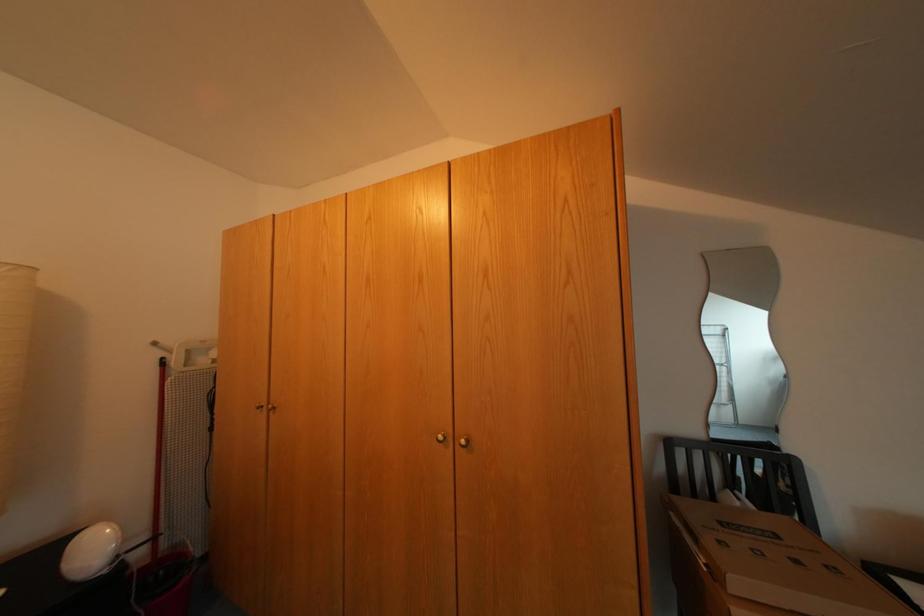
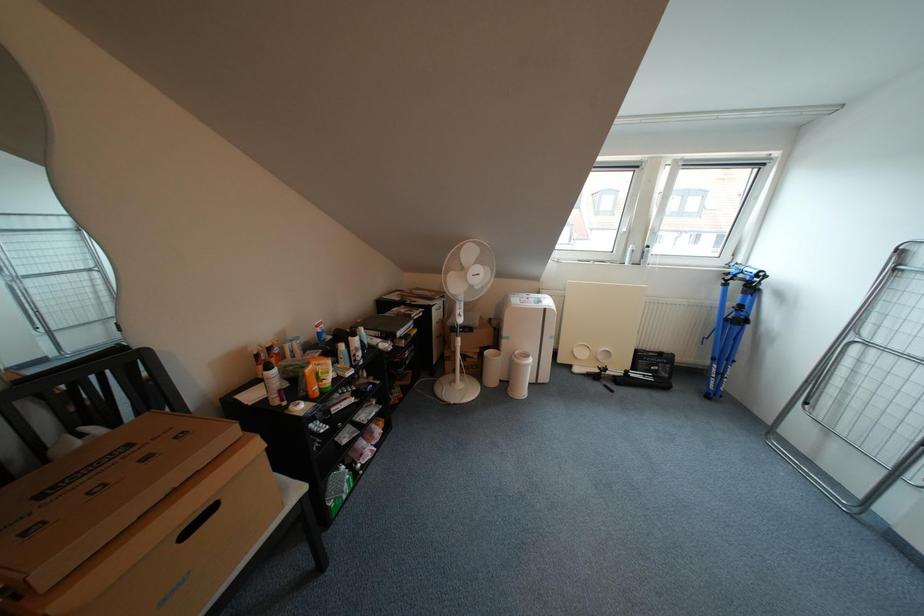
How did the camera likely rotate?

The camera's rotation is toward right-down.